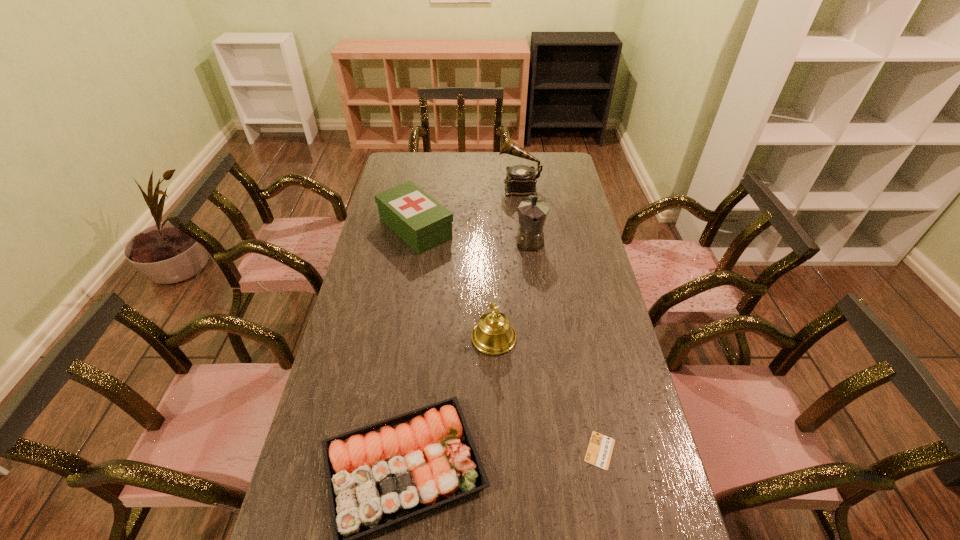
Identify the location of free spot located on the back of the bell. (492, 287).

Image resolution: width=960 pixels, height=540 pixels. In order to click on vacant space located 0.370m on the front of the first-aid kit in this screenshot , I will do `click(398, 330)`.

At what (x,y) coordinates should I click in order to perform the action: click on free space located 0.110m on the back of the shortest object. Please return your answer as a coordinate pair (x, y). Looking at the image, I should click on (588, 395).

Identify the location of object present at the left edge. The width and height of the screenshot is (960, 540). (419, 220).

Where is `object present at the right edge`? object present at the right edge is located at coordinates (600, 447).

Where is `vacant area at the far edge`? This screenshot has width=960, height=540. vacant area at the far edge is located at coordinates (465, 163).

You are a GUI agent. You are given a task and a screenshot of the screen. Output one action in this format:
    pyautogui.click(x=<x>, y=<y>)
    Task: Click on the vacant area at the left edge of the desktop
    Image resolution: width=960 pixels, height=540 pixels.
    Given the screenshot: What is the action you would take?
    pyautogui.click(x=326, y=417)

Locate an element on the screen. Image resolution: width=960 pixels, height=540 pixels. vacant space at the right edge is located at coordinates (564, 254).

Locate an element on the screen. The height and width of the screenshot is (540, 960). vacant area at the far right corner is located at coordinates (551, 165).

Identify the location of empty space that is in between the bell and the fourth tallest object. The width and height of the screenshot is (960, 540). (455, 283).